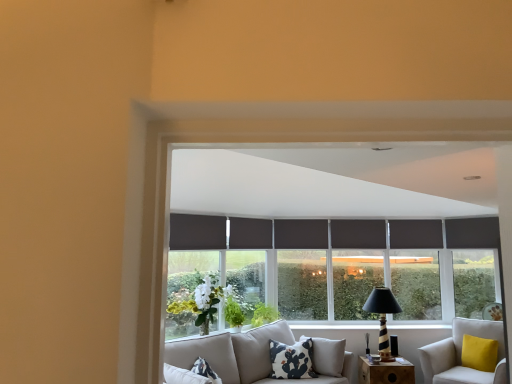
Question: Which direction should I rotate to look at dark gray fabric curtain at center, which is counted as the 1th curtain, starting from the back, — up or down?

Choices:
 (A) down
 (B) up

Answer: (A)

Question: Is wooden at lower right to the left of green leafy plant at center, the 2th plant when ordered from left to right, from the viewer's perspective?

Choices:
 (A) no
 (B) yes

Answer: (A)

Question: Does wooden at lower right have a lesser height compared to green leafy plant at center, the 1th plant from the right?

Choices:
 (A) no
 (B) yes

Answer: (A)

Question: Would you say wooden at lower right is outside green leafy plant at center, the 2th plant when ordered from left to right?

Choices:
 (A) no
 (B) yes

Answer: (B)

Question: Is wooden at lower right wider than green leafy plant at center, the first plant in the back-to-front sequence?

Choices:
 (A) no
 (B) yes

Answer: (B)

Question: Is wooden at lower right bigger than green leafy plant at center, the 1th plant from the right?

Choices:
 (A) yes
 (B) no

Answer: (A)

Question: Does wooden at lower right turn towards green leafy plant at center, the 2th plant when ordered from left to right?

Choices:
 (A) no
 (B) yes

Answer: (A)

Question: Is wooden at lower right to the right of white fabric studio couch at lower right from the viewer's perspective?

Choices:
 (A) yes
 (B) no

Answer: (B)

Question: Is wooden at lower right bigger than white fabric studio couch at lower right?

Choices:
 (A) yes
 (B) no

Answer: (B)

Question: Is wooden at lower right with white fabric studio couch at lower right?

Choices:
 (A) yes
 (B) no

Answer: (B)

Question: From the image's perspective, is wooden at lower right beneath white fabric studio couch at lower right?

Choices:
 (A) yes
 (B) no

Answer: (A)

Question: Is wooden at lower right further to camera compared to white fabric studio couch at lower right?

Choices:
 (A) no
 (B) yes

Answer: (B)

Question: Is white fabric studio couch at lower right inside wooden at lower right?

Choices:
 (A) no
 (B) yes

Answer: (A)

Question: Is white cotton pillow with black cactus print at center further to the viewer compared to white fabric studio couch at lower right?

Choices:
 (A) yes
 (B) no

Answer: (A)